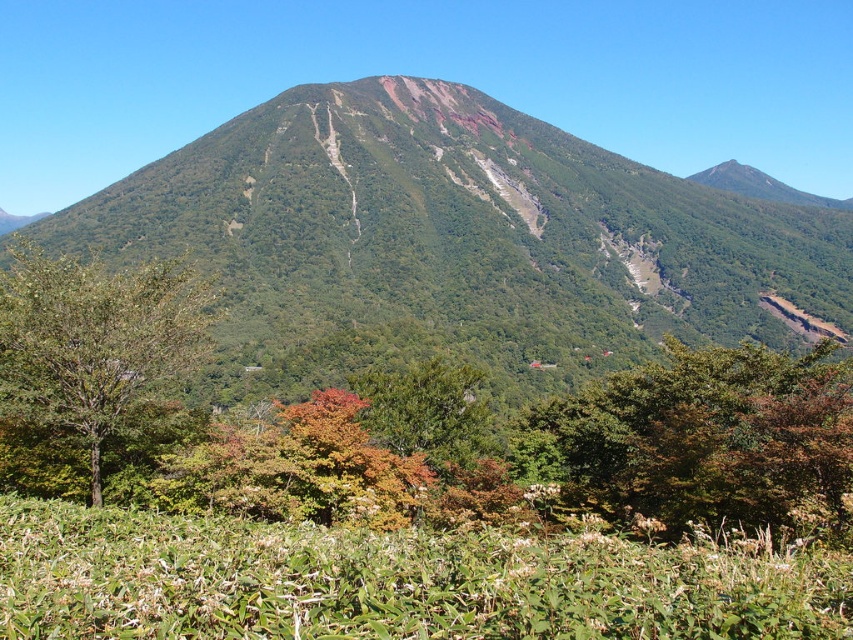
You are standing at the base of the mountain and looking towards the summit. Which direction should you look to see the green leafy tree at center?

The green leafy tree at center is located at point coordinates of 0.686 on the x axis and 0.837 on the y axis. Since the coordinate system starts at the bottom left corner of the image, the tree is positioned to the right and above your current position. Therefore, you should look towards the upper right direction to see the green leafy tree at center.

You are standing at the base of the mountain and looking towards the summit. You notice two points marked on the mountain slope. The first point is at coordinates point (786, 499) and the second is at point (96, 506). Which of these two points is closer to you?

Point (786, 499) is in front of point (96, 506), so the point closer to you is point (786, 499).

You are standing in a mountain landscape and want to take a photo of both the green textured mountain at center and the green leafy tree at center. Which object should you focus on first to ensure it appears sharp in your photo?

You should focus on the green textured mountain at center first because it is closer to you than the green leafy tree at center, so focusing on it will ensure it stays sharp while the tree may appear slightly blurred if not adjusted.